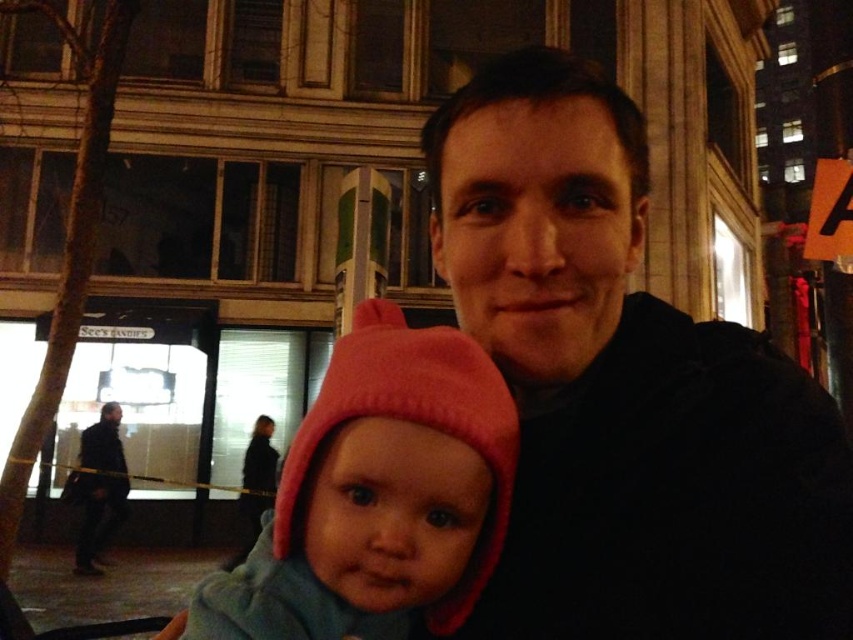
You are a delivery person standing at the edge of the sidewalk. You need to deliver a package to the person wearing the black matte jacket at center. The package requires a signature, and you must ensure the delivery is contactless. Since you can only approach up to 1.5 meters, will you be able to hand over the package without stepping closer than 1.5 meters?

The black matte jacket at center and viewer are 1.47 meters apart, so yes, you can deliver the package without stepping closer than 1.5 meters since the distance is within the required limit.

You are a photographer trying to capture a closeup of the black matte jacket at center and the pink fleece hat at center. If you want to ensure both are fully visible in the frame without cropping, which object should you focus on to maintain the composition?

The black matte jacket at center is wider than the pink fleece hat at center, so focusing on the black matte jacket at center ensures both objects remain fully visible in the frame without cropping.

You are standing in the nighttime urban scene and want to walk from the point at coordinates point (640, 561) to the point at coordinates point (460, 621). Which direction should you move in relation to the building facade?

Point (640, 561) is in front of point (460, 621), so you should move backward towards the building facade to reach point (460, 621).